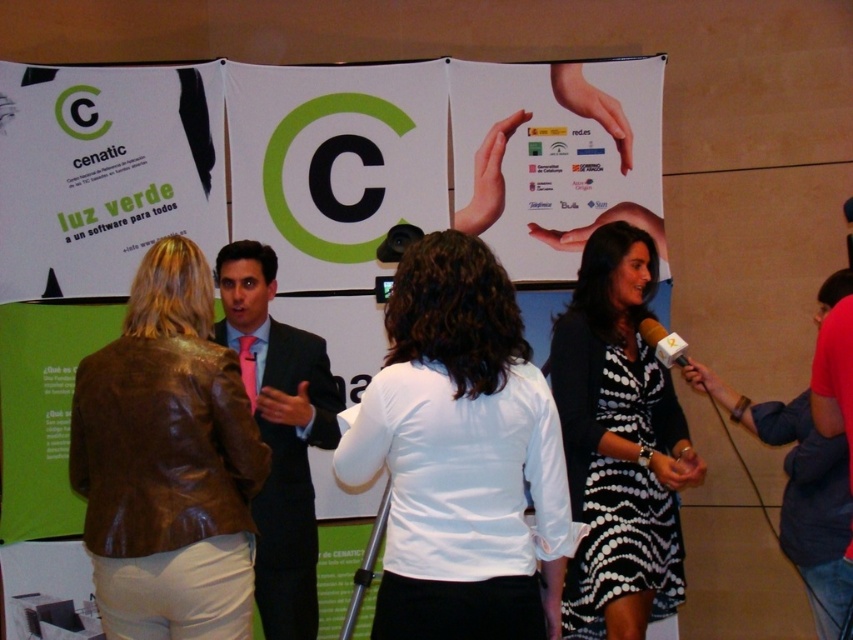
Question: Is brown leather jacket at center smaller than red shirt at lower right?

Choices:
 (A) no
 (B) yes

Answer: (B)

Question: Among these points, which one is farthest from the camera?

Choices:
 (A) (468, 140)
 (B) (543, 448)
 (C) (757, 428)
 (D) (267, 465)

Answer: (A)

Question: Among these points, which one is farthest from the camera?

Choices:
 (A) (467, 260)
 (B) (242, 636)
 (C) (221, 340)
 (D) (125, 68)

Answer: (D)

Question: Does pink silk tie at center appear under red shirt at lower right?

Choices:
 (A) no
 (B) yes

Answer: (A)

Question: Which of these objects is positioned closest to the red shirt at lower right?

Choices:
 (A) white paper poster at center
 (B) brown leather jacket at center

Answer: (A)

Question: From the image, what is the correct spatial relationship of brown leather jacket at center in relation to red shirt at lower right?

Choices:
 (A) right
 (B) left

Answer: (B)